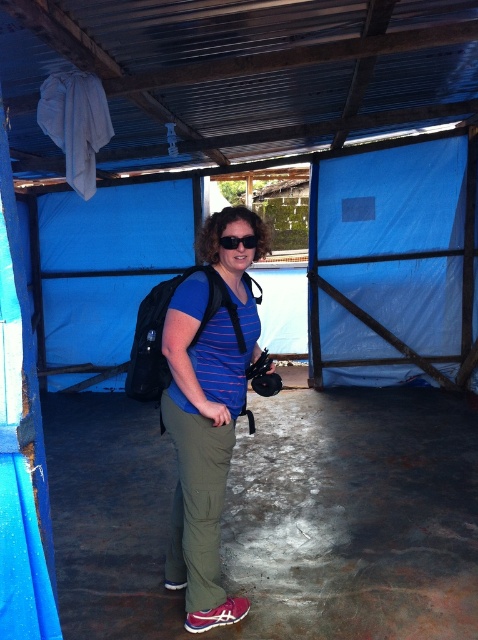
Does matte blue shirt at center come in front of black matte sunglasses at center?

Yes, matte blue shirt at center is in front of black matte sunglasses at center.

Which of these two, matte blue shirt at center or black matte sunglasses at center, stands taller?

Standing taller between the two is matte blue shirt at center.

What do you see at coordinates (207, 412) in the screenshot?
I see `matte blue shirt at center` at bounding box center [207, 412].

Identify the location of matte blue shirt at center. This screenshot has width=478, height=640. (207, 412).